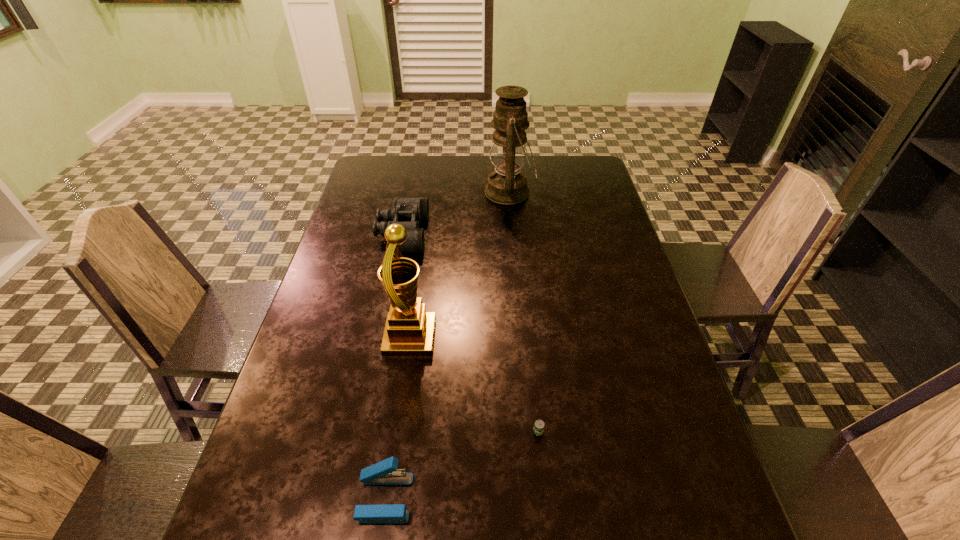
At what (x,y) coordinates should I click in order to perform the action: click on oil lamp. Please return your answer as a coordinate pair (x, y). Looking at the image, I should click on (507, 185).

Where is `award`? award is located at coordinates (409, 331).

You are a GUI agent. You are given a task and a screenshot of the screen. Output one action in this format:
    pyautogui.click(x=<x>, y=<y>)
    Task: Click on the binoculars
    The image size is (960, 540).
    Given the screenshot: What is the action you would take?
    pyautogui.click(x=409, y=212)

Locate an element on the screen. the nearest object is located at coordinates (385, 472).

The height and width of the screenshot is (540, 960). Find the location of `the fourth tallest object`. the fourth tallest object is located at coordinates (385, 472).

Identify the location of the shortest object. The height and width of the screenshot is (540, 960). (539, 425).

Where is `the fourth farthest object`? the fourth farthest object is located at coordinates (x=539, y=425).

Identify the location of vacant point located 0.050m on the back of the oil lamp. (508, 167).

Locate an element on the screen. The height and width of the screenshot is (540, 960). free region located on the front-facing side of the award is located at coordinates [525, 338].

At what (x,y) coordinates should I click in order to perform the action: click on free region located 0.280m at the eyepieces of the binoculars. Please return your answer as a coordinate pair (x, y). Looking at the image, I should click on (514, 233).